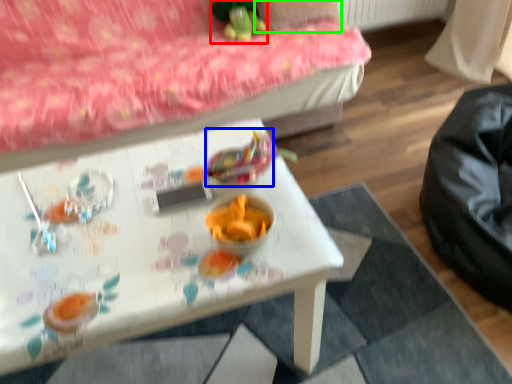
Question: Which is farther away from toy (highlighted by a red box)? food (highlighted by a blue box) or pillow (highlighted by a green box)?

Choices:
 (A) food
 (B) pillow

Answer: (A)